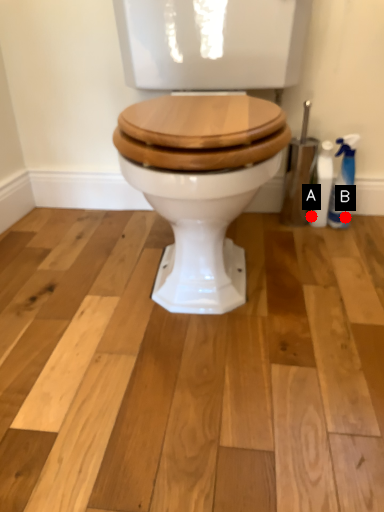
Question: Two points are circled on the image, labeled by A and B beside each circle. Which point is closer to the camera taking this photo?

Choices:
 (A) A is closer
 (B) B is closer

Answer: (B)